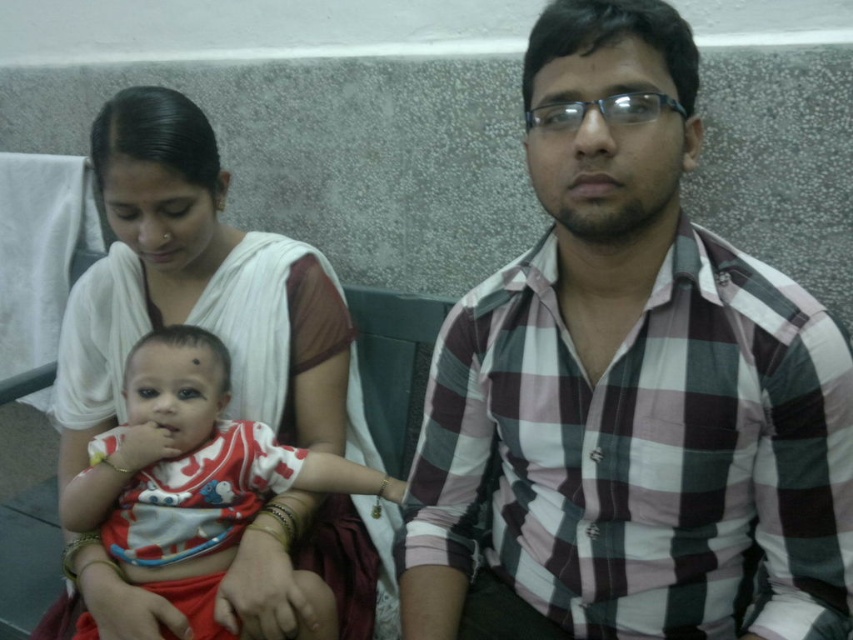
How distant is plaid cotton shirt at center from white cotton shirt at center?

A distance of 39.05 centimeters exists between plaid cotton shirt at center and white cotton shirt at center.

Is point (802, 417) closer to camera compared to point (189, 467)?

Yes, it is.

The image size is (853, 640). I want to click on plaid cotton shirt at center, so click(631, 384).